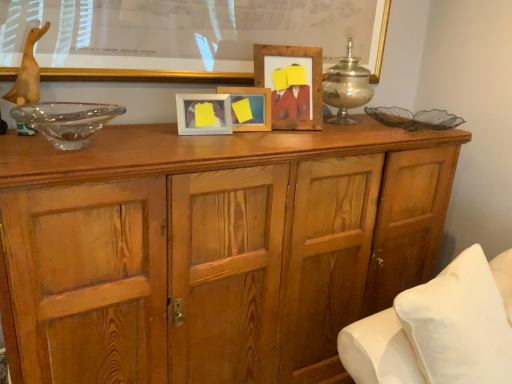
Find the location of a particular element. vacant region to the right of matte wooden picture frame at center, acting as the first picture frame starting from the left is located at coordinates (246, 128).